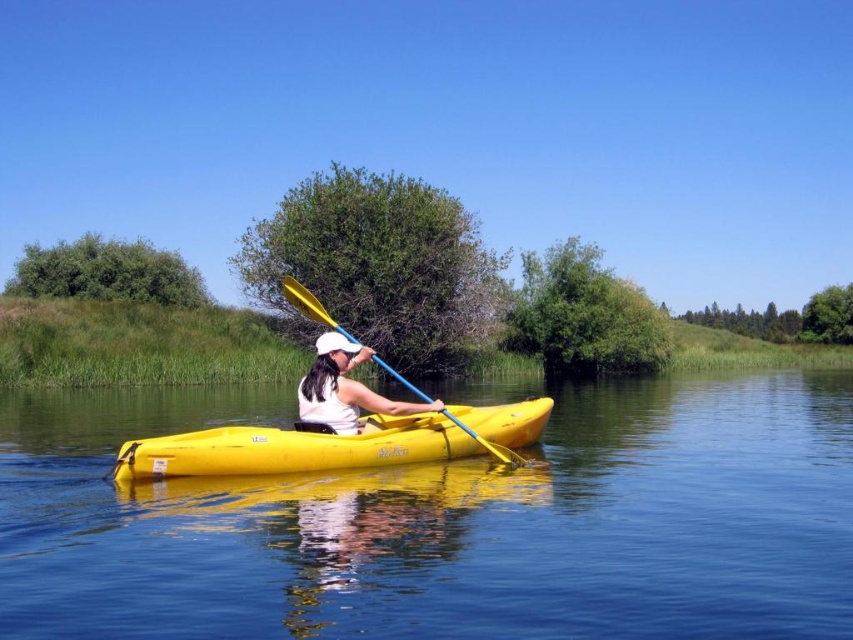
Question: Which point is farther from the camera taking this photo?

Choices:
 (A) (740, 563)
 (B) (428, 396)

Answer: (B)

Question: Is yellow matte kayak at center smaller than white matte visor at center?

Choices:
 (A) yes
 (B) no

Answer: (A)

Question: Is white matte visor at center in front of yellow plastic paddle at center?

Choices:
 (A) yes
 (B) no

Answer: (B)

Question: Is white matte visor at center smaller than yellow plastic paddle at center?

Choices:
 (A) no
 (B) yes

Answer: (B)

Question: Which is farther from the yellow matte kayak at center?

Choices:
 (A) yellow plastic kayak at center
 (B) white matte visor at center
 (C) yellow plastic paddle at center

Answer: (A)

Question: Estimate the real-world distances between objects in this image. Which object is closer to the yellow matte kayak at center?

Choices:
 (A) yellow plastic paddle at center
 (B) yellow plastic kayak at center
 (C) white matte visor at center

Answer: (C)